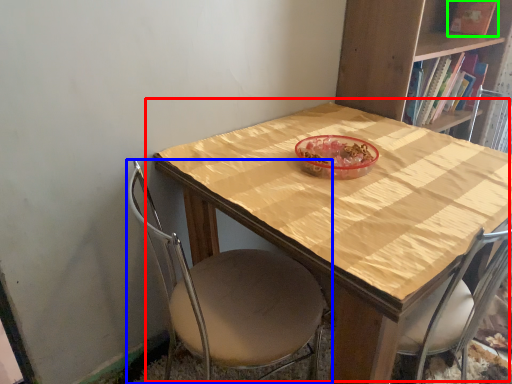
Question: Based on their relative distances, which object is farther from table (highlighted by a red box)? Choose from chair (highlighted by a blue box) and book (highlighted by a green box).

Choices:
 (A) chair
 (B) book

Answer: (B)